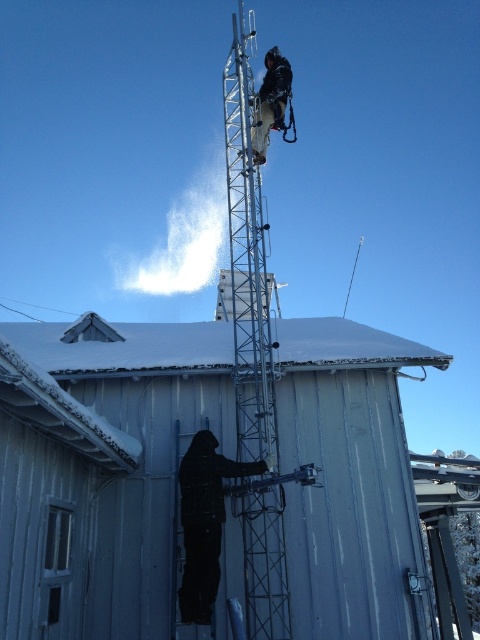
Question: Which of the following is the farthest from the observer?

Choices:
 (A) (217, 508)
 (B) (351, 493)
 (C) (305, 353)

Answer: (C)

Question: Which object appears farthest from the camera in this image?

Choices:
 (A) metallic blue hut at lower center
 (B) white snow-covered roof at center
 (C) dark brown leather jacket at upper center

Answer: (C)

Question: Which object appears closest to the camera in this image?

Choices:
 (A) black matte jacket at center
 (B) metallic blue hut at lower center
 (C) dark brown leather jacket at upper center

Answer: (B)

Question: Is metallic blue hut at lower center wider than black matte jacket at center?

Choices:
 (A) yes
 (B) no

Answer: (B)

Question: Is white snow-covered roof at center closer to the viewer compared to dark brown leather jacket at upper center?

Choices:
 (A) no
 (B) yes

Answer: (B)

Question: Is metallic blue hut at lower center bigger than white snow-covered roof at center?

Choices:
 (A) yes
 (B) no

Answer: (B)